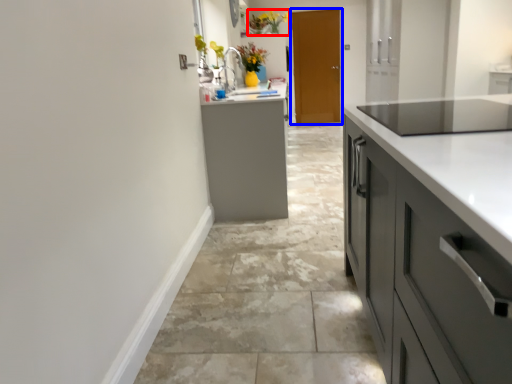
Question: Which object is closer to the camera taking this photo, floral arrangement (highlighted by a red box) or door (highlighted by a blue box)?

Choices:
 (A) floral arrangement
 (B) door

Answer: (A)